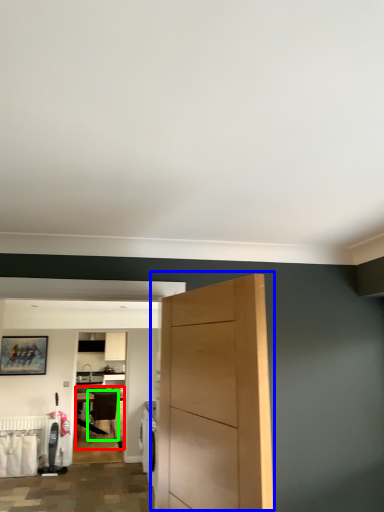
Question: Estimate the real-world distances between objects in this image. Which object is closer to table (highlighted by a red box), door (highlighted by a blue box) or chair (highlighted by a green box)?

Choices:
 (A) door
 (B) chair

Answer: (B)